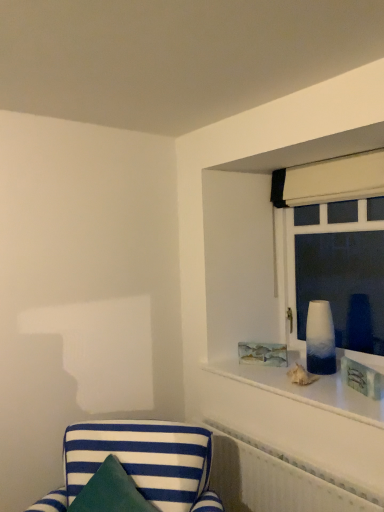
Question: Does matte wooden picture frame at upper right have a greater height compared to white fabric curtain at upper right?

Choices:
 (A) no
 (B) yes

Answer: (A)

Question: Is matte wooden picture frame at upper right oriented towards white fabric curtain at upper right?

Choices:
 (A) yes
 (B) no

Answer: (B)

Question: Considering the relative sizes of matte wooden picture frame at upper right and white fabric curtain at upper right in the image provided, is matte wooden picture frame at upper right wider than white fabric curtain at upper right?

Choices:
 (A) yes
 (B) no

Answer: (B)

Question: Is matte wooden picture frame at upper right oriented away from white fabric curtain at upper right?

Choices:
 (A) yes
 (B) no

Answer: (B)

Question: From the image's perspective, is matte wooden picture frame at upper right on top of white fabric curtain at upper right?

Choices:
 (A) yes
 (B) no

Answer: (B)

Question: Does point (142, 441) appear closer or farther from the camera than point (322, 170)?

Choices:
 (A) farther
 (B) closer

Answer: (B)

Question: From a real-world perspective, is blue and white striped fabric chair at lower left physically located above or below white fabric curtain at upper right?

Choices:
 (A) below
 (B) above

Answer: (A)

Question: Which is correct: blue and white striped fabric chair at lower left is inside white fabric curtain at upper right, or outside of it?

Choices:
 (A) inside
 (B) outside

Answer: (B)

Question: From the image's perspective, is blue and white striped fabric chair at lower left located above or below white fabric curtain at upper right?

Choices:
 (A) below
 (B) above

Answer: (A)

Question: Does point (213, 505) appear closer or farther from the camera than point (264, 359)?

Choices:
 (A) farther
 (B) closer

Answer: (B)

Question: Visually, is blue and white striped fabric chair at lower left positioned to the left or to the right of matte wooden picture frame at upper right?

Choices:
 (A) right
 (B) left

Answer: (B)

Question: Would you say blue and white striped fabric chair at lower left is inside or outside matte wooden picture frame at upper right?

Choices:
 (A) outside
 (B) inside

Answer: (A)

Question: Based on their sizes in the image, would you say blue and white striped fabric chair at lower left is bigger or smaller than matte wooden picture frame at upper right?

Choices:
 (A) small
 (B) big

Answer: (B)

Question: In the image, is white textured radiator at lower right positioned in front of or behind matte wooden picture frame at upper right?

Choices:
 (A) behind
 (B) front

Answer: (B)

Question: Considering the positions of white textured radiator at lower right and matte wooden picture frame at upper right in the image, is white textured radiator at lower right bigger or smaller than matte wooden picture frame at upper right?

Choices:
 (A) small
 (B) big

Answer: (B)